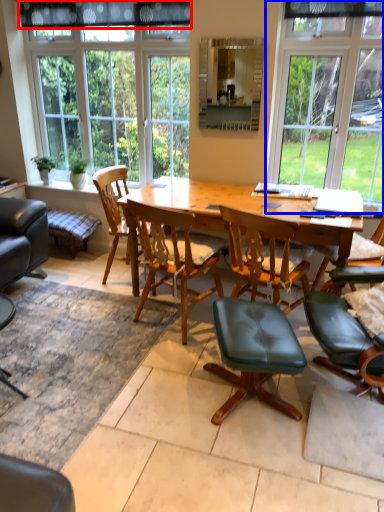
Question: Among these objects, which one is farthest to the camera, curtain (highlighted by a red box) or window (highlighted by a blue box)?

Choices:
 (A) curtain
 (B) window

Answer: (A)